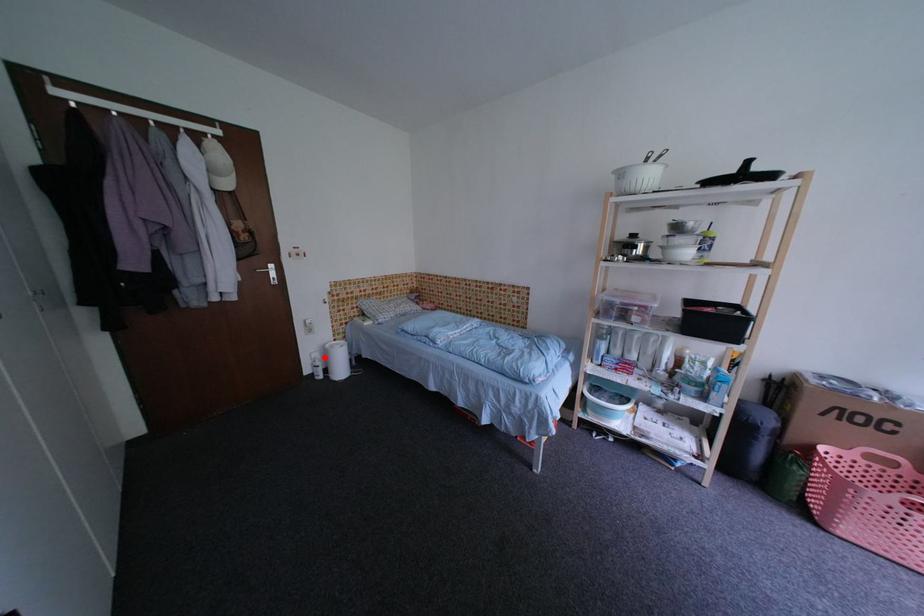
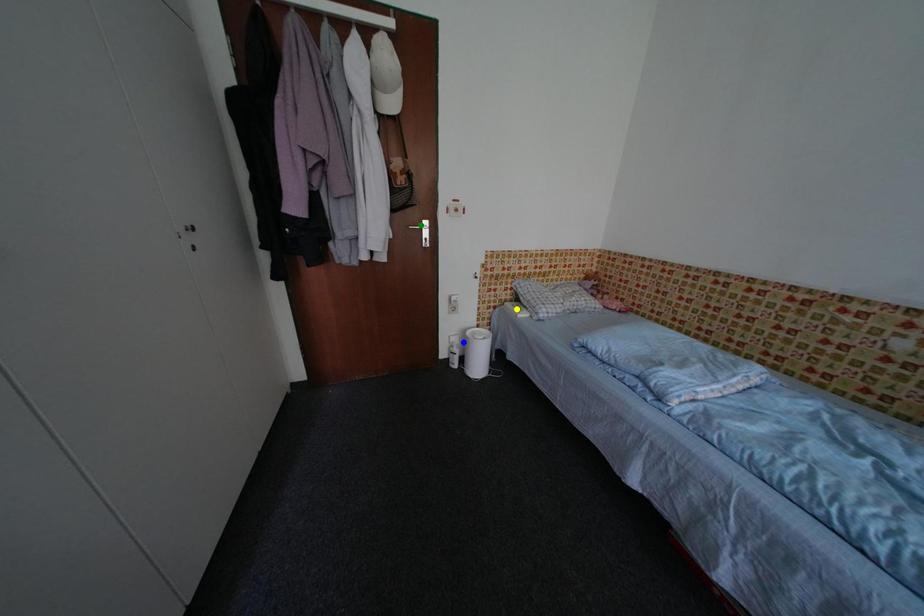
Question: I am providing you with two images of the same scene from different viewpoints. A red point is marked on the first image. You are given multiple points on the second image. Which point in image 2 represents the same 3d spot as the red point in image 1?

Choices:
 (A) green point
 (B) blue point
 (C) yellow point

Answer: (B)